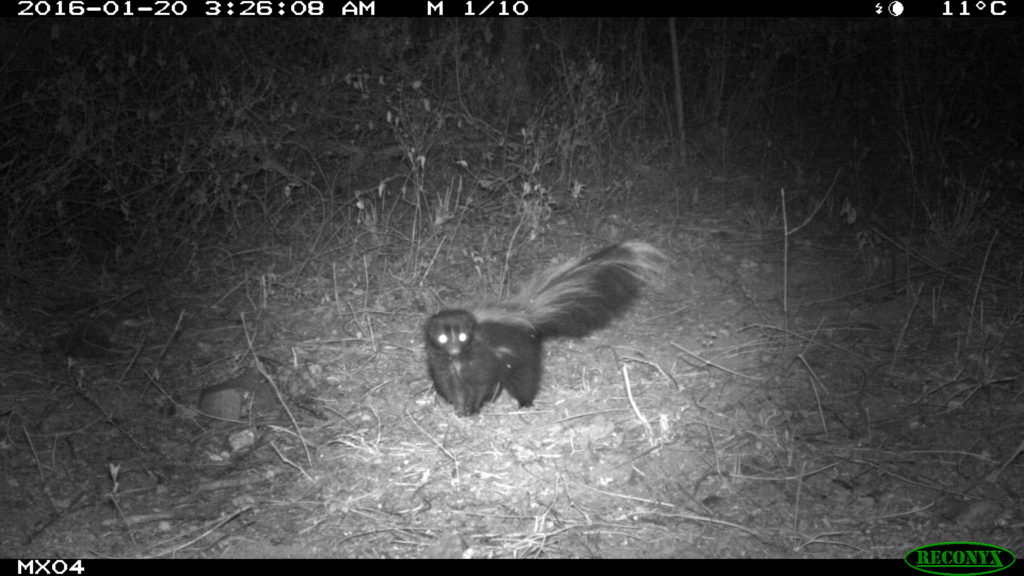
Where is `white fur`? The image size is (1024, 576). white fur is located at coordinates (486, 312).